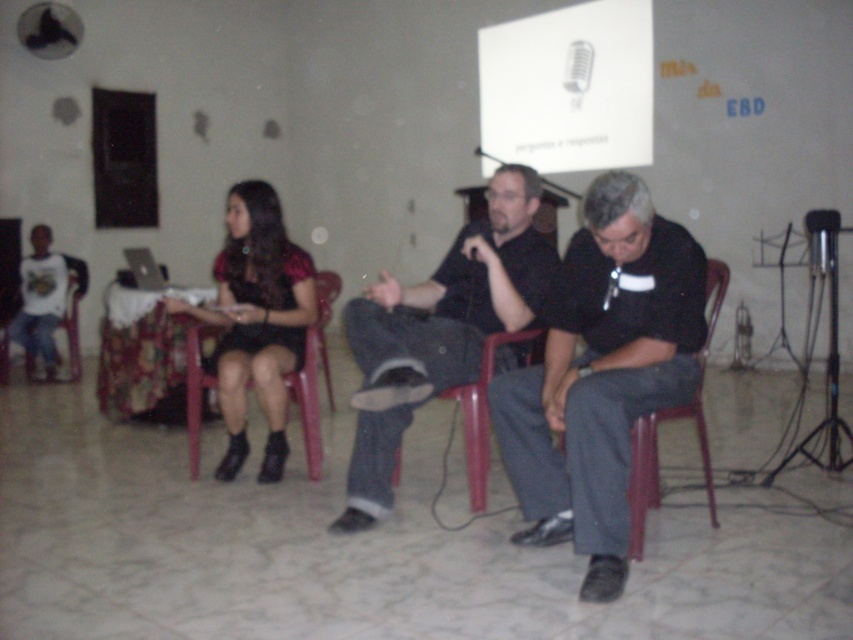
You are organizing a small meeting and need to seat two people. You have a red plastic chair at lower right and a matte plastic chair at left. Which chair should you choose if you want to accommodate someone who needs more seating space?

The red plastic chair at lower right is bigger than the matte plastic chair at left, so you should choose the red plastic chair at lower right to accommodate someone who needs more seating space.